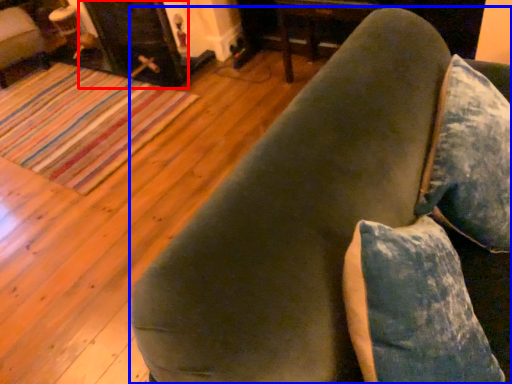
Question: Which of the following is the farthest to the observer, fireplace (highlighted by a red box) or furniture (highlighted by a blue box)?

Choices:
 (A) fireplace
 (B) furniture

Answer: (A)